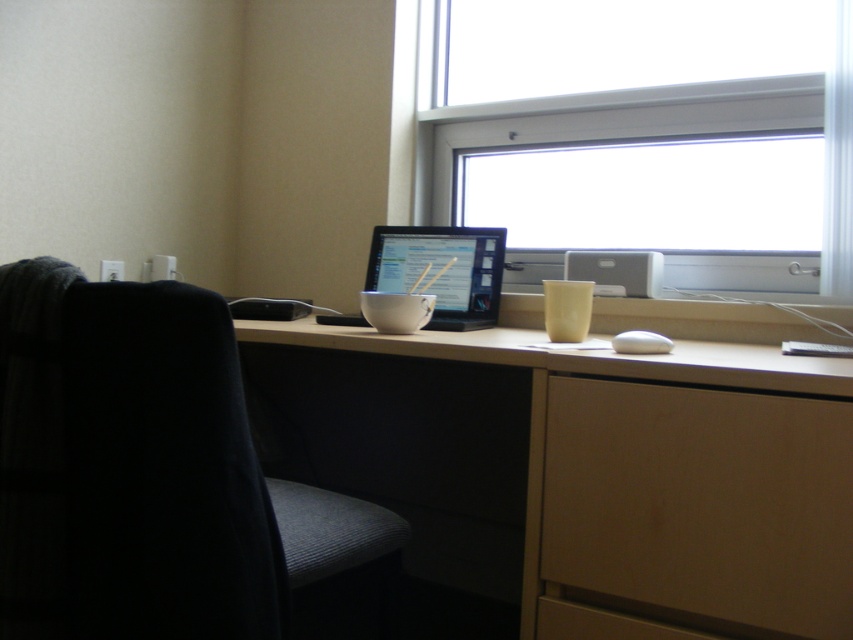
Describe the element at coordinates (584, 467) in the screenshot. I see `light wood computer desk at center` at that location.

What do you see at coordinates (584, 467) in the screenshot?
I see `light wood computer desk at center` at bounding box center [584, 467].

The image size is (853, 640). What are the coordinates of `light wood computer desk at center` in the screenshot? It's located at (584, 467).

Between point (671, 189) and point (456, 262), which one is positioned in front?

Point (456, 262) is in front.

In the scene shown: Is transparent glass window at upper center closer to the viewer compared to matte black monitor at center?

Yes.

Is point (456, 161) closer to viewer compared to point (380, 285)?

No.

What are the coordinates of `transparent glass window at upper center` in the screenshot? It's located at pos(648,138).

Is wooden drawer at lower right above matte black monitor at center?

No, wooden drawer at lower right is not above matte black monitor at center.

Who is positioned more to the right, wooden drawer at lower right or matte black monitor at center?

wooden drawer at lower right

Is point (838, 518) closer to viewer compared to point (426, 227)?

Yes, it is.

Locate an element on the screen. wooden drawer at lower right is located at coordinates (701, 499).